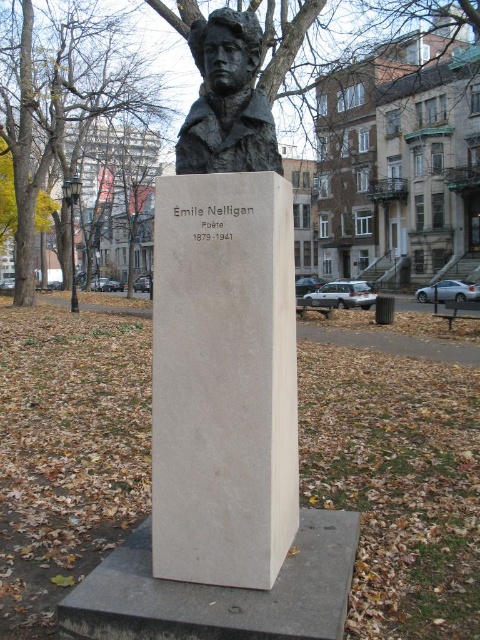
You are a gardener who needs to place a 5 feet wide decorative arch between the green leafy tree at upper left and the yellow leafy tree at upper left. Based on the scene, will the arch fit between them?

The distance between the green leafy tree at upper left and yellow leafy tree at upper left is 4.66 feet, so the 5 feet wide decorative arch will not fit between them.

You are an artist standing in front of the bronze bust sculpture of Emile Nelligan. You notice two trees in the background at the upper left corner. Which tree is closer to the sculpture, the green leafy tree at upper left or the yellow leafy tree at upper left?

The green leafy tree at upper left is closer to the sculpture because it is positioned over the yellow leafy tree at upper left, indicating it is in front.